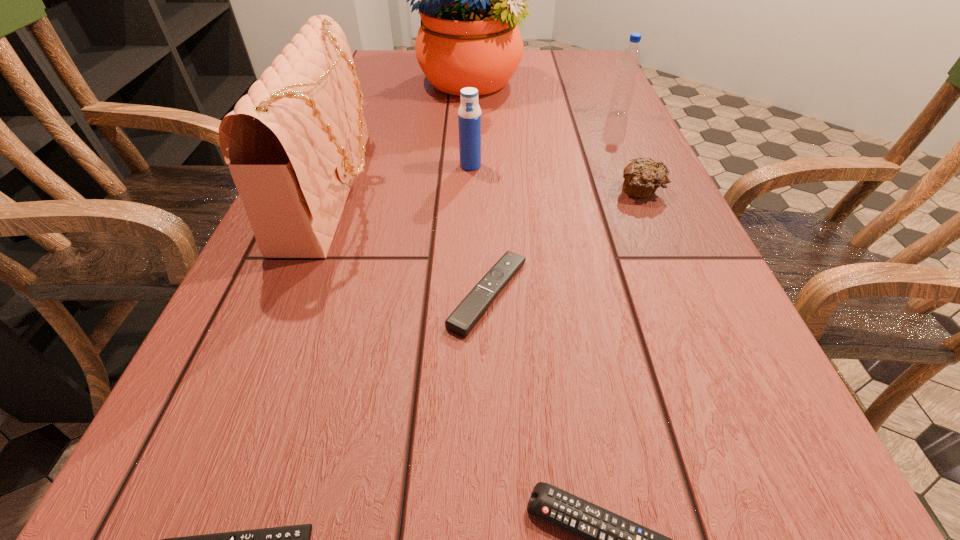
Identify the location of vacant space at the left edge of the desktop. The height and width of the screenshot is (540, 960). (352, 191).

Identify the location of free space at the right edge of the desktop. Image resolution: width=960 pixels, height=540 pixels. (756, 428).

In the image, there is a desktop. In order to click on free region at the far left corner in this screenshot , I will do `click(404, 73)`.

This screenshot has width=960, height=540. I want to click on free spot between the right water bottle and the third shortest object, so click(x=553, y=204).

Identify the location of vacant area between the flower arrangement and the muffin. Image resolution: width=960 pixels, height=540 pixels. (557, 136).

Locate an element on the screen. The width and height of the screenshot is (960, 540). vacant space in between the left water bottle and the muffin is located at coordinates (556, 178).

You are a GUI agent. You are given a task and a screenshot of the screen. Output one action in this format:
    pyautogui.click(x=<x>, y=<y>)
    Task: Click on the vacant area between the tallest remote control and the fourth shortest object
    The image size is (960, 540).
    Given the screenshot: What is the action you would take?
    pyautogui.click(x=564, y=242)

You are a GUI agent. You are given a task and a screenshot of the screen. Output one action in this format:
    pyautogui.click(x=<x>, y=<y>)
    Task: Click on the unoccupied position between the handbag and the tallest remote control
    Image resolution: width=960 pixels, height=540 pixels.
    Given the screenshot: What is the action you would take?
    pyautogui.click(x=411, y=241)

Where is `unoccupied area between the right water bottle and the farthest remote control`? Image resolution: width=960 pixels, height=540 pixels. unoccupied area between the right water bottle and the farthest remote control is located at coordinates (553, 204).

Image resolution: width=960 pixels, height=540 pixels. Identify the location of object that is the fifth closest one to the shortest object. (642, 177).